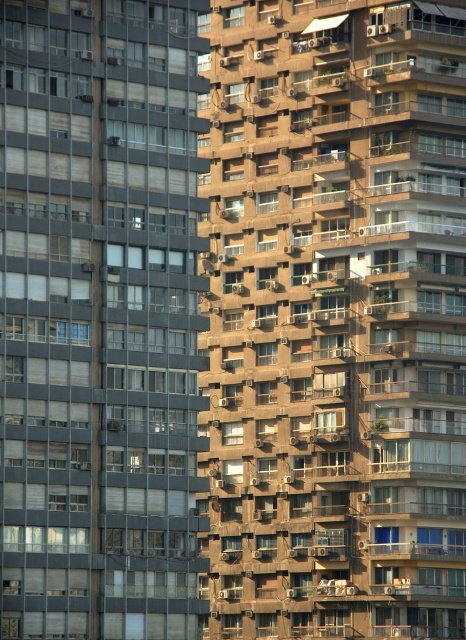
Who is more forward, (310, 321) or (203, 157)?

Positioned in front is point (203, 157).

Is brown concrete building at center taller than matte glass windows at left?

Yes, brown concrete building at center is taller than matte glass windows at left.

The image size is (466, 640). I want to click on brown concrete building at center, so click(x=336, y=317).

Locate an element on the screen. brown concrete building at center is located at coordinates (336, 317).